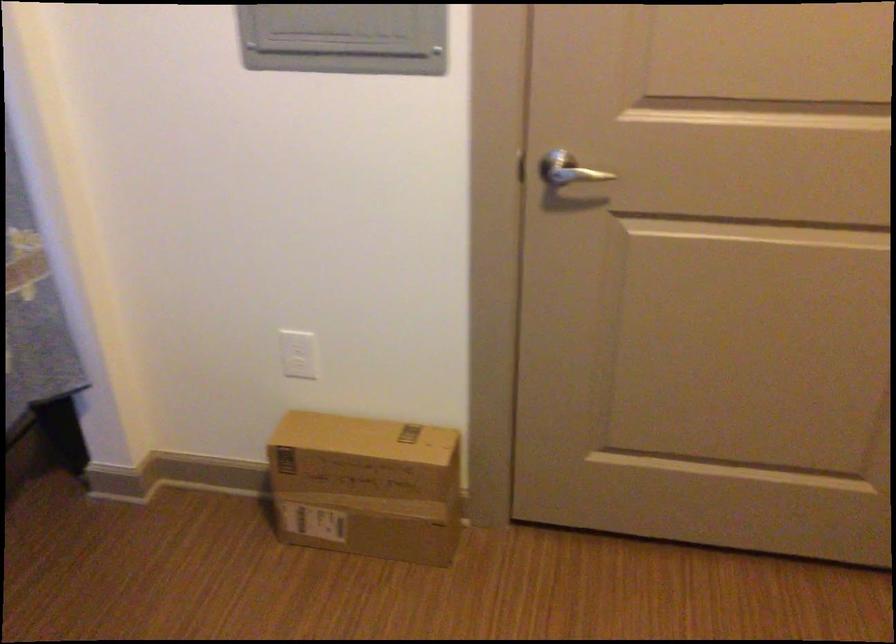
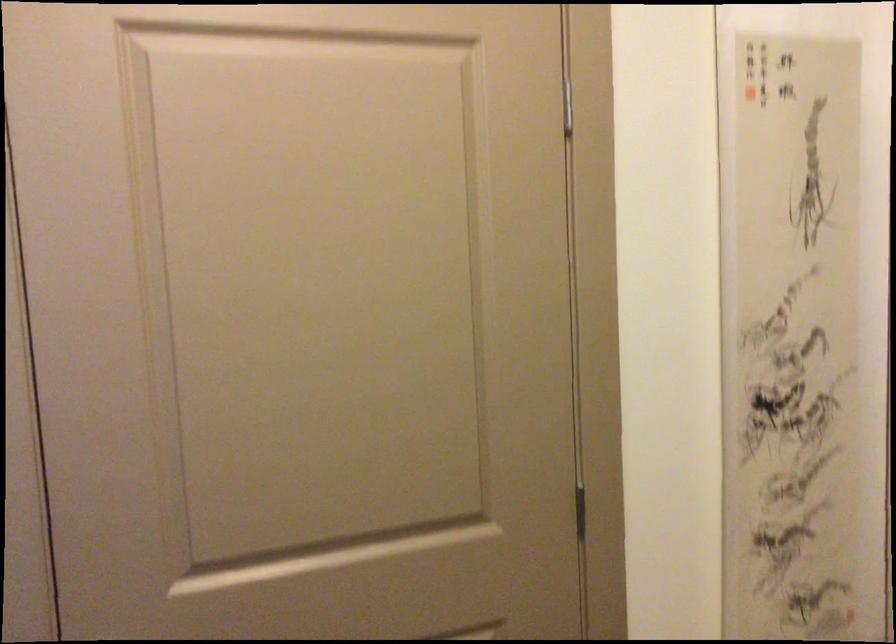
The images are taken continuously from a first-person perspective. In which direction is your viewpoint rotating?

The rotation direction of the camera is right-up.